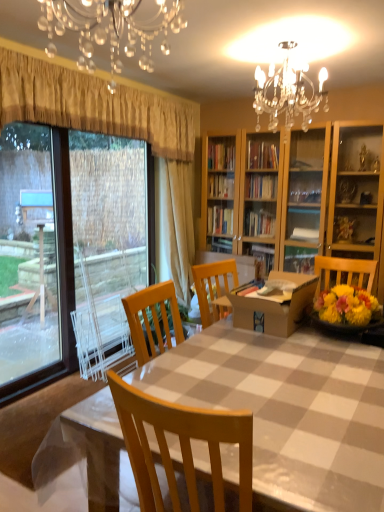
Question: Is clear glass window at left bigger or smaller than checkered plastic table at center?

Choices:
 (A) small
 (B) big

Answer: (A)

Question: From a real-world perspective, is clear glass window at left physically located above or below checkered plastic table at center?

Choices:
 (A) above
 (B) below

Answer: (A)

Question: Which object is the closest to the gold textured curtain at upper left, positioned as the 1th curtain in front-to-back order?

Choices:
 (A) beige fabric curtain at center, which appears as the 2th curtain when viewed from the front
 (B) checkered plastic table at center
 (C) clear glass window at left
 (D) crystal glass chandelier at upper center
 (E) cardboard box at center

Answer: (D)

Question: Considering the real-world distances, which object is closest to the cardboard box at center?

Choices:
 (A) clear glass window at left
 (B) crystal glass chandelier at upper center
 (C) checkered plastic table at center
 (D) gold textured curtain at upper left, positioned as the 1th curtain in front-to-back order
 (E) beige fabric curtain at center, the 1th curtain when ordered from back to front

Answer: (C)